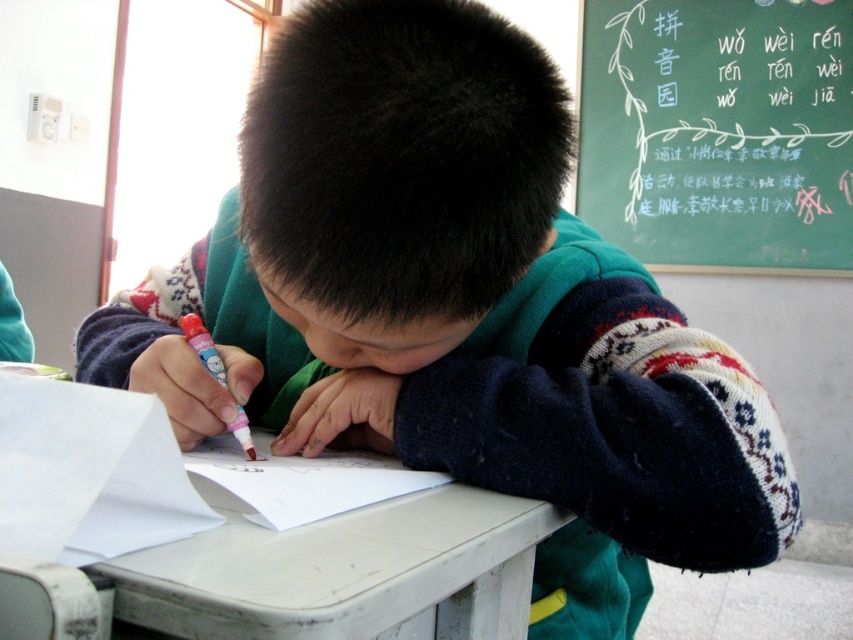
Which is above, green chalkboard at upper right or white matte table at center?

green chalkboard at upper right

Identify the location of green chalkboard at upper right. This screenshot has height=640, width=853. (718, 132).

Between point (717, 256) and point (206, 604), which one is positioned behind?

The point (717, 256) is more distant.

At what (x,y) coordinates should I click in order to perform the action: click on green chalkboard at upper right. Please return your answer as a coordinate pair (x, y). The width and height of the screenshot is (853, 640). Looking at the image, I should click on (718, 132).

Describe the element at coordinates (718, 132) in the screenshot. I see `green chalkboard at upper right` at that location.

Can you confirm if green chalkboard at upper right is taller than pink plastic marker at center?

Yes.

Is point (840, 36) closer to camera compared to point (207, 358)?

No, (840, 36) is further to viewer.

The image size is (853, 640). I want to click on green chalkboard at upper right, so tap(718, 132).

Based on the photo, is white paper at lower left taller than pink plastic marker at center?

No, white paper at lower left is not taller than pink plastic marker at center.

From the picture: Is white paper at lower left bigger than pink plastic marker at center?

Actually, white paper at lower left might be smaller than pink plastic marker at center.

Does point (119, 492) lie behind point (221, 362)?

No, (119, 492) is in front of (221, 362).

This screenshot has width=853, height=640. Identify the location of white paper at lower left. (90, 474).